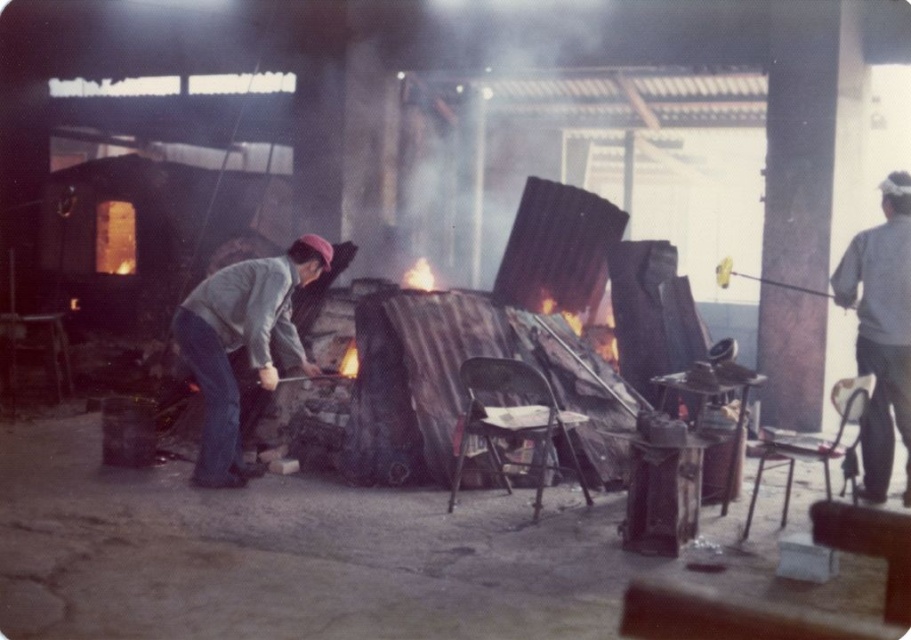
You are a visitor in the workshop and want to approach the gray fabric jacket at center and the gray fabric shirt at right. Which one should you walk towards first to reach the closer one?

You should first approach the gray fabric jacket at center because it is closer to you than the gray fabric shirt at right.

You are standing at the center of the workshop and want to reach the point labeled as point (907, 326). However, there is an obstacle at point (273, 257). Will you have to go around the obstacle to reach your destination?

Yes, you will have to go around the obstacle at point (273, 257) because it is behind point (907, 326), meaning it lies along the path towards your destination.